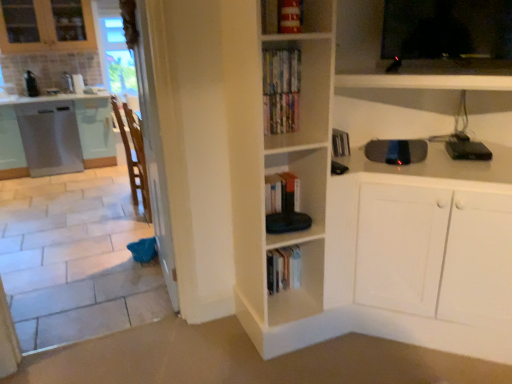
Question: Is satin white dishwasher at left, which appears as the 2th cabinetry when viewed from the right, taller than black plastic device at upper right, the second appliance viewed from the back?

Choices:
 (A) no
 (B) yes

Answer: (B)

Question: From the image's perspective, is satin white dishwasher at left, which is the 1th cabinetry from left to right, above black plastic device at upper right, which is the 1th appliance in right-to-left order?

Choices:
 (A) yes
 (B) no

Answer: (A)

Question: Is satin white dishwasher at left, which appears as the 2th cabinetry when viewed from the right, completely or partially outside of black plastic device at upper right, the second appliance viewed from the back?

Choices:
 (A) yes
 (B) no

Answer: (A)

Question: Considering the relative positions of satin white dishwasher at left, which appears as the 2th cabinetry when viewed from the right, and black plastic device at upper right, arranged as the 2th appliance when viewed from the front, in the image provided, is satin white dishwasher at left, which appears as the 2th cabinetry when viewed from the right, to the right of black plastic device at upper right, arranged as the 2th appliance when viewed from the front, from the viewer's perspective?

Choices:
 (A) no
 (B) yes

Answer: (A)

Question: Can you confirm if satin white dishwasher at left, which is the 1th cabinetry from left to right, is shorter than black plastic device at upper right, arranged as the second appliance when viewed from the top?

Choices:
 (A) yes
 (B) no

Answer: (B)

Question: Is satin white dishwasher at left, which is the 1th cabinetry from left to right, to the left of black plastic device at upper right, arranged as the 2th appliance when viewed from the front, from the viewer's perspective?

Choices:
 (A) yes
 (B) no

Answer: (A)

Question: Is the position of brown wooden chair at left less distant than that of brushed metal toaster at left, the 1th appliance from the left?

Choices:
 (A) no
 (B) yes

Answer: (B)

Question: Would you say brown wooden chair at left is a long distance from brushed metal toaster at left, which is the third appliance from front to back?

Choices:
 (A) no
 (B) yes

Answer: (B)

Question: From a real-world perspective, is brown wooden chair at left located beneath brushed metal toaster at left, the 1th appliance from the left?

Choices:
 (A) no
 (B) yes

Answer: (B)

Question: From the image's perspective, is brown wooden chair at left under brushed metal toaster at left, arranged as the first appliance when viewed from the back?

Choices:
 (A) no
 (B) yes

Answer: (B)

Question: From a real-world perspective, is brown wooden chair at left positioned over brushed metal toaster at left, which is the third appliance from front to back, based on gravity?

Choices:
 (A) yes
 (B) no

Answer: (B)

Question: Is brown wooden chair at left outside of brushed metal toaster at left, the third appliance when ordered from bottom to top?

Choices:
 (A) no
 (B) yes

Answer: (B)

Question: Is black plastic skateboard at upper right, acting as the third appliance starting from the back, at the left side of black glossy tv at upper right?

Choices:
 (A) yes
 (B) no

Answer: (A)